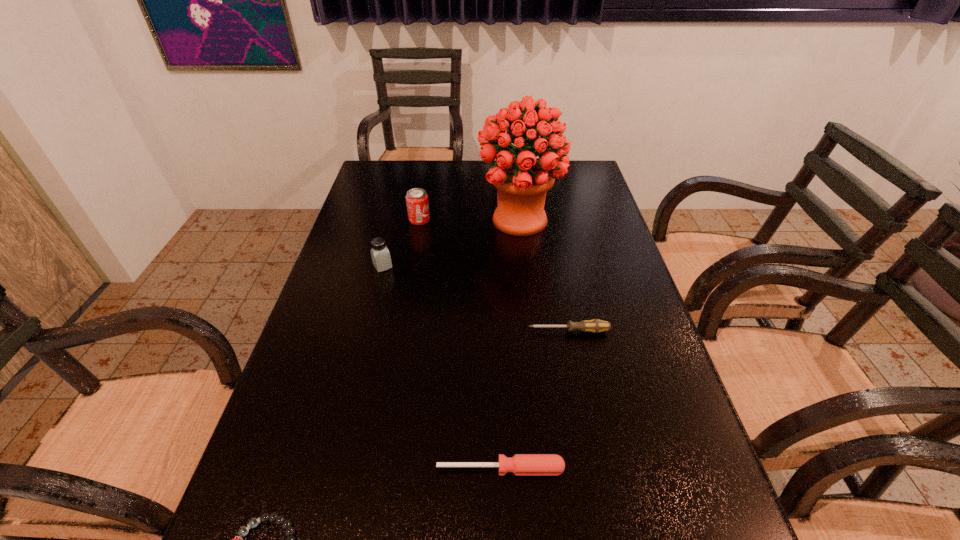
The width and height of the screenshot is (960, 540). I want to click on vacant space that is in between the saltshaker and the fourth object from right to left, so click(401, 243).

Locate an element on the screen. The height and width of the screenshot is (540, 960). vacant area that lies between the fourth farthest object and the saltshaker is located at coordinates (476, 299).

I want to click on free space that is in between the tallest object and the saltshaker, so click(451, 243).

Locate an element on the screen. free space that is in between the fourth object from right to left and the fourth farthest object is located at coordinates (494, 275).

Identify which object is located as the second nearest to the bouquet. Please provide its 2D coordinates. Your answer should be formatted as a tuple, i.e. [(x, y)], where the tuple contains the x and y coordinates of a point satisfying the conditions above.

[(381, 259)]

Identify which object is the fifth closest to the can. Please provide its 2D coordinates. Your answer should be formatted as a tuple, i.e. [(x, y)], where the tuple contains the x and y coordinates of a point satisfying the conditions above.

[(272, 518)]